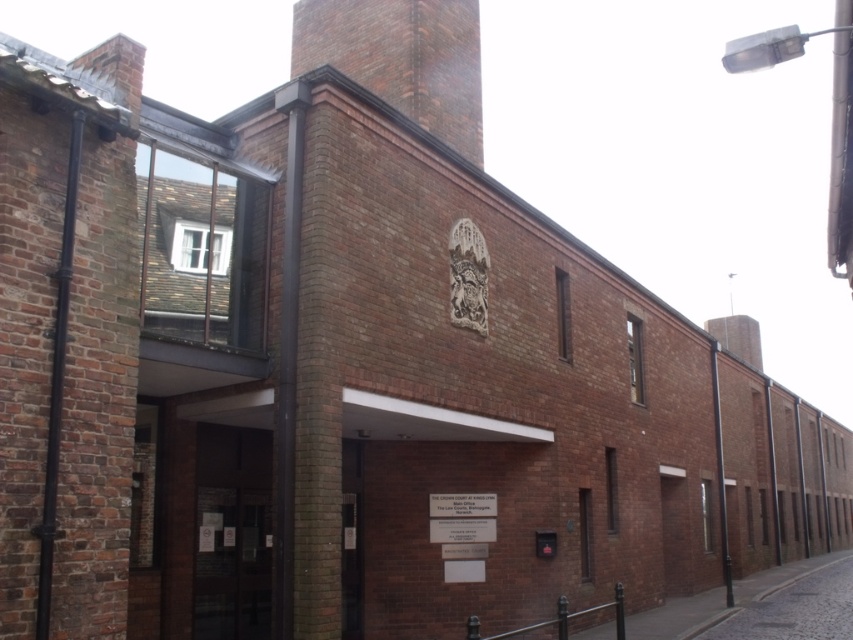
Question: Where is transparent glass door at center located in relation to cobblestone street at lower right in the image?

Choices:
 (A) below
 (B) above

Answer: (B)

Question: Which object appears closest to the camera in this image?

Choices:
 (A) transparent glass door at center
 (B) cobblestone street at lower right
 (C) brown brick chimney at upper center

Answer: (A)

Question: In this image, where is brown brick chimney at upper center located relative to cobblestone street at lower right?

Choices:
 (A) right
 (B) left

Answer: (B)

Question: Does transparent glass door at center have a larger size compared to cobblestone street at lower right?

Choices:
 (A) yes
 (B) no

Answer: (B)

Question: Which is farther from the transparent glass door at center?

Choices:
 (A) cobblestone street at lower right
 (B) brown brick chimney at upper center

Answer: (A)

Question: Which point appears closest to the camera in this image?

Choices:
 (A) (757, 609)
 (B) (402, 76)
 (C) (198, 460)

Answer: (C)